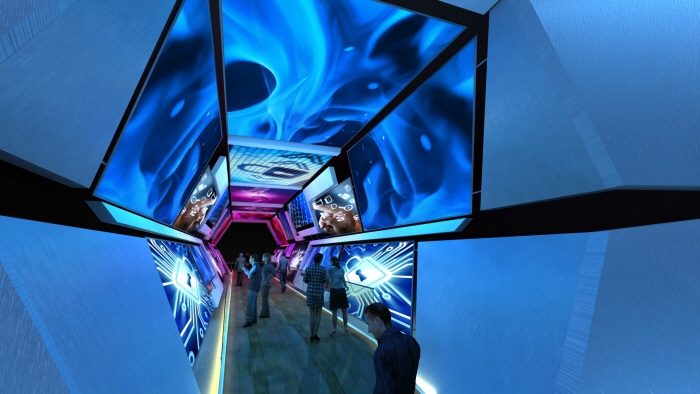
At what (x,y) coordinates should I click in order to perform the action: click on left side wall. Please return your answer as a coordinate pair (x, y). The image size is (700, 394). Looking at the image, I should click on (463, 295).